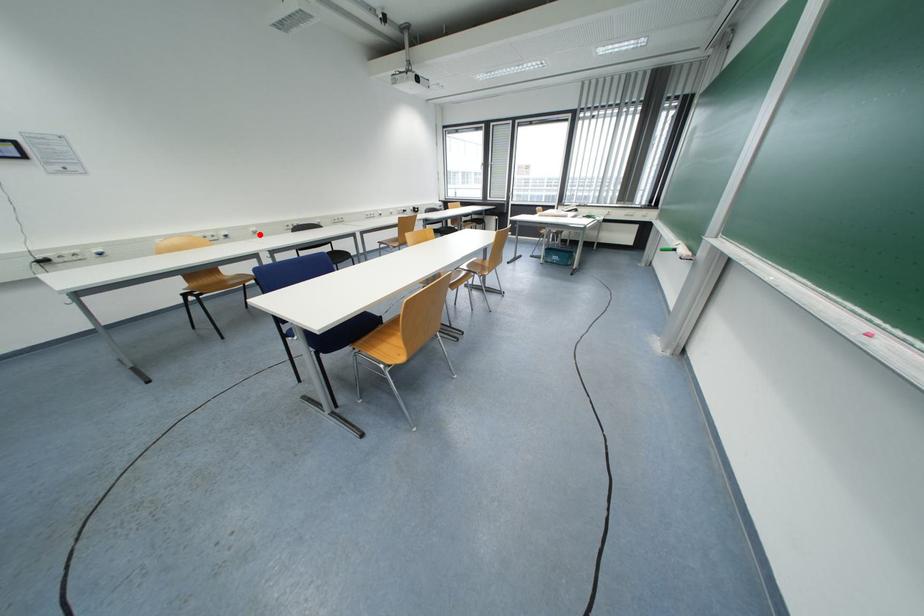
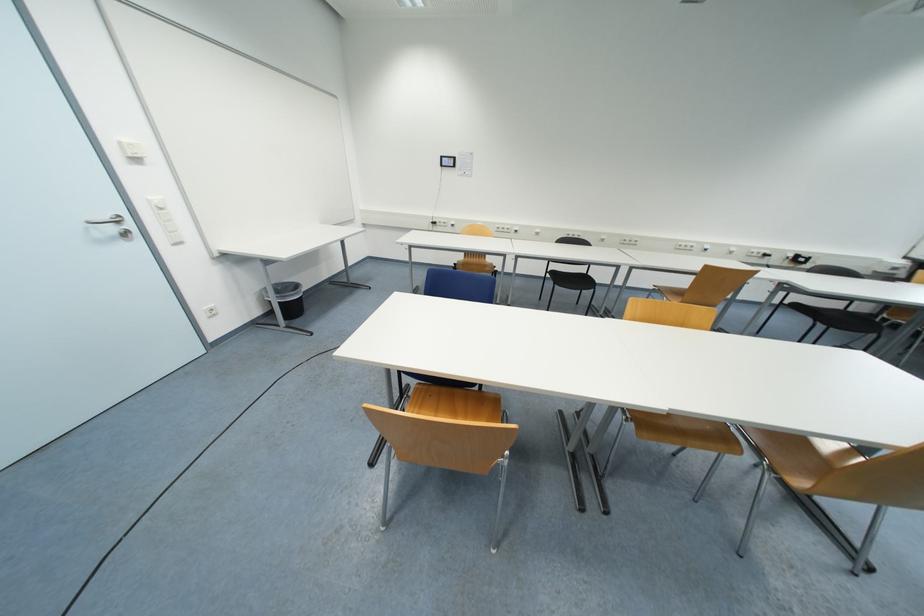
In the second image, find the point that corresponds to the highlighted location in the first image.

(541, 236)